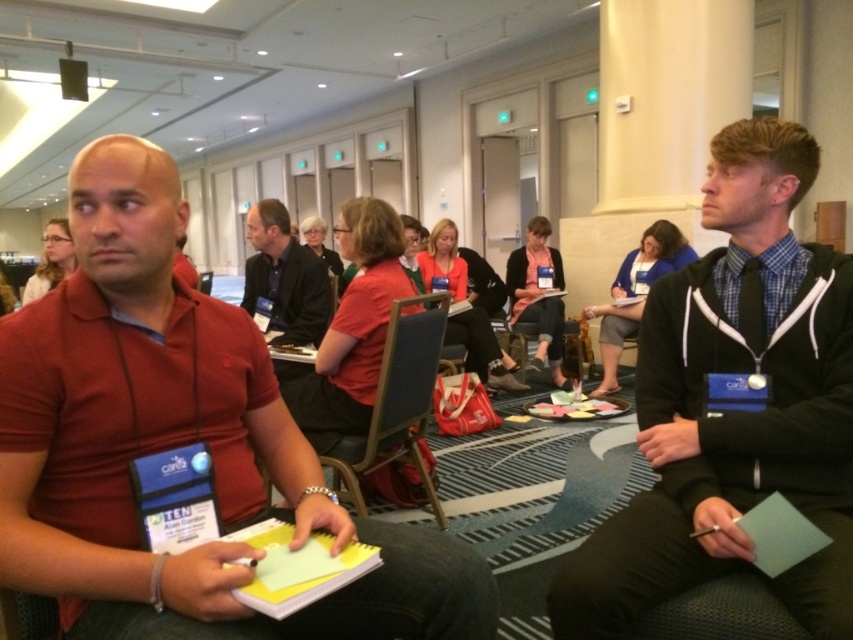
You are standing at the entrance of the conference room and see the dark gray suit at center and the matte black chair at center. Which object is closer to the right side of the room?

The dark gray suit at center is closer to the right side of the room because it is positioned to the right of the matte black chair at center.

You are organizing a photo shoot and need to arrange two participants in a row. The first participant is wearing a matte red polo shirt at left, and the second is wearing a blue fabric jacket at center. Based on their clothing widths, which participant should stand closer to the camera to ensure both appear equally wide in the photo?

The matte red polo shirt at left has a lesser width compared to the blue fabric jacket at center. To make both appear equally wide in the photo, the matte red polo shirt at left should stand closer to the camera than the blue fabric jacket at center.